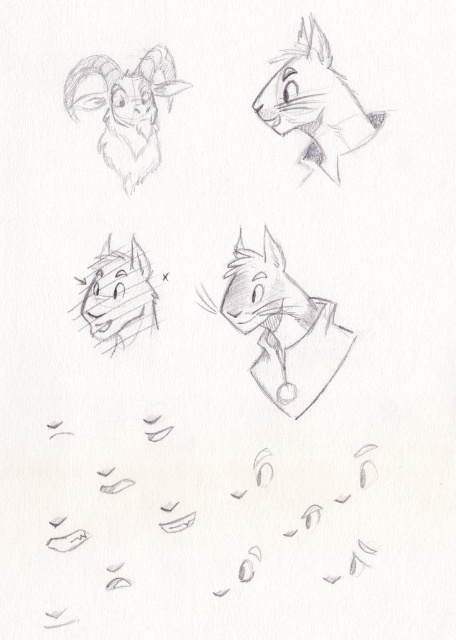
You are an artist who needs to place a 12 inch ruler between the smooth gray cat at upper right and the smooth gray wolf at center. Is there enough space to fit the ruler between them?

The smooth gray cat at upper right is 10.51 inches from the smooth gray wolf at center, so the 12 inch ruler cannot fit between them because the distance is shorter than the ruler.

You are an artist trying to add depth to your drawing. You have two points in your sketch, point (x=268, y=275) and point (x=77, y=80). Which point should you shade more to create the illusion of depth?

Point (x=268, y=275) is further to the viewer than point (x=77, y=80), so you should shade point (x=268, y=275) more to create the illusion of depth.

Based on the scene description, which animal character is taller between the smooth gray cat at center and the gray pencil sketch of goat at upper left?

The smooth gray cat at center is much taller than the gray pencil sketch of goat at upper left according to the description.